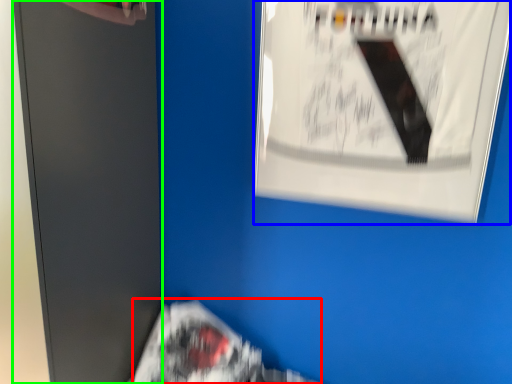
Question: Which object is the closest to the flyer (highlighted by a red box)? Choose among these: poster (highlighted by a blue box) or file cabinet (highlighted by a green box).

Choices:
 (A) poster
 (B) file cabinet

Answer: (B)